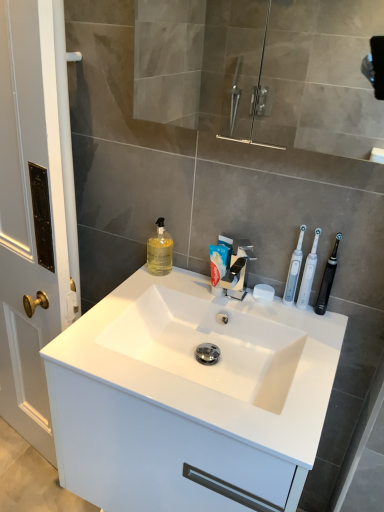
At what (x,y) coordinates should I click in order to perform the action: click on vacant space situated on the left part of polished chrome faucet at center. Please return your answer as a coordinate pair (x, y). Looking at the image, I should click on (175, 292).